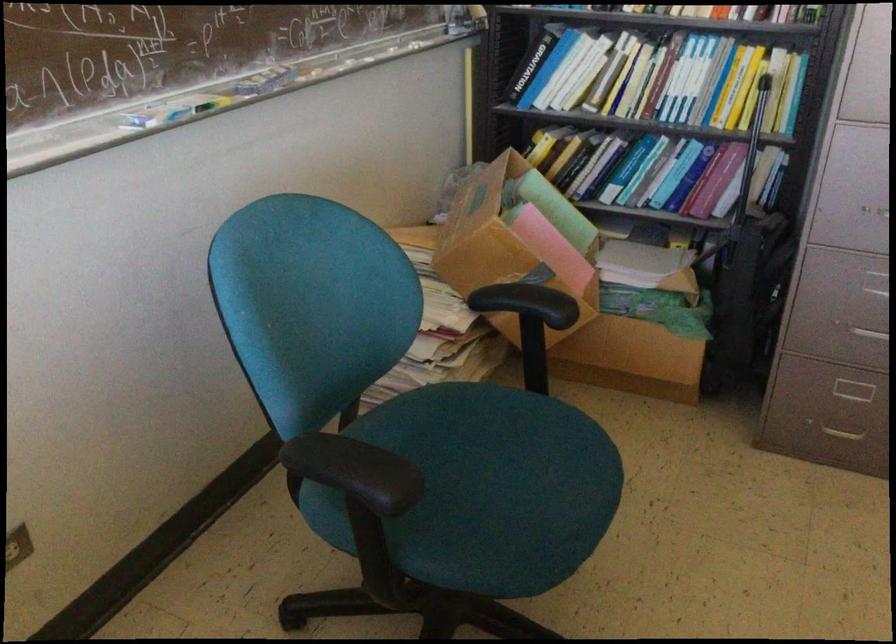
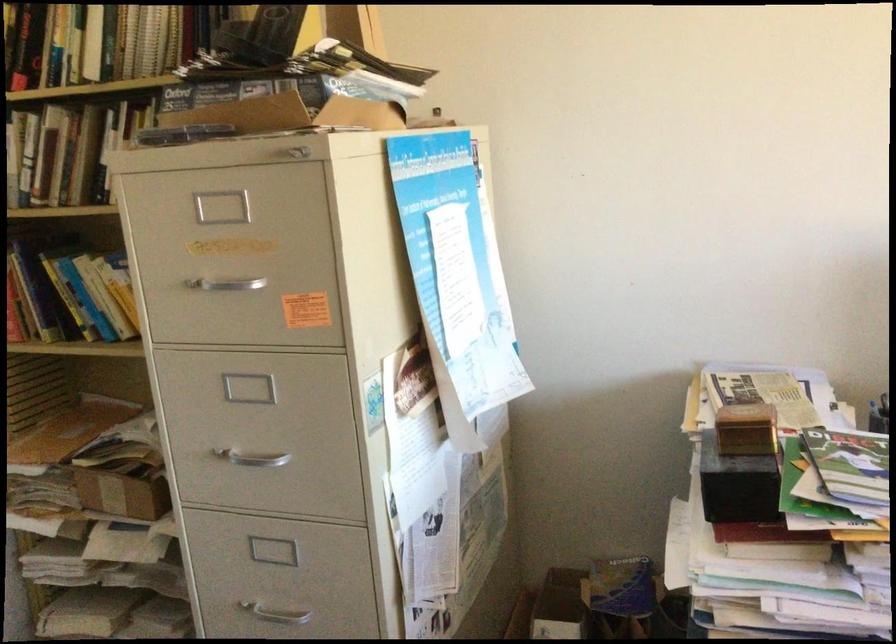
How did the camera likely rotate?

The camera rotated toward right-down.